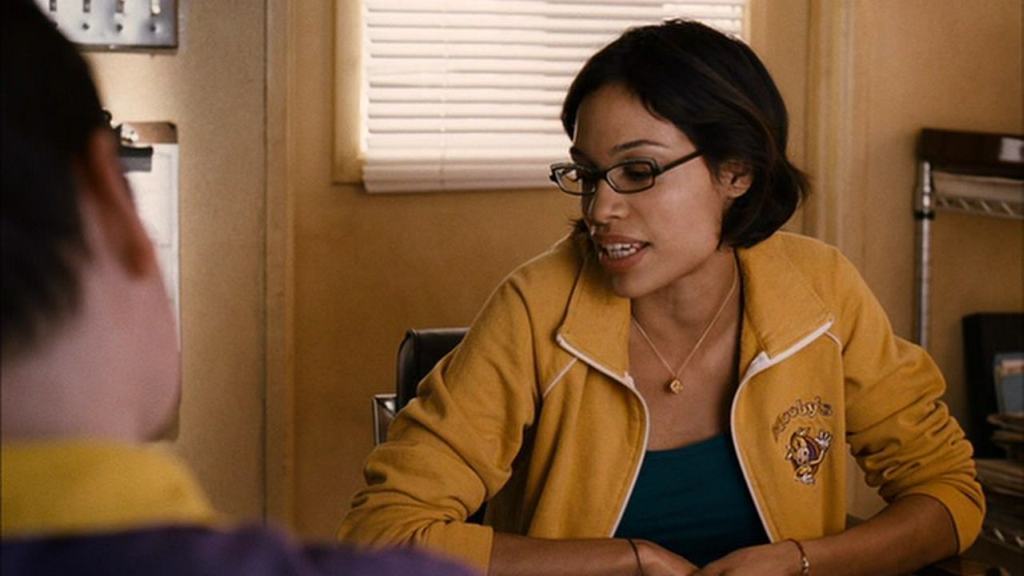
This screenshot has width=1024, height=576. Find the location of `blinds`. blinds is located at coordinates (534, 75).